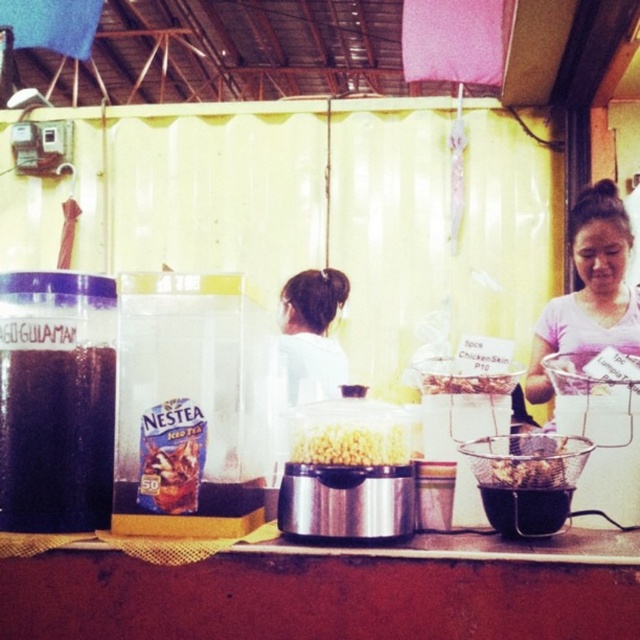
Question: In this image, where is white fabric hair at center located relative to brown crispy chicken skin at center?

Choices:
 (A) left
 (B) right

Answer: (A)

Question: Among these objects, which one is nearest to the camera?

Choices:
 (A) white fabric hair at center
 (B) brown crispy chicken skin at center

Answer: (B)

Question: Does yellow matte popcorn at center have a larger size compared to brown crispy snack at center?

Choices:
 (A) no
 (B) yes

Answer: (B)

Question: Which of the following is the closest to the observer?

Choices:
 (A) brown crispy snack at center
 (B) pink fabric at upper right
 (C) yellow matte popcorn at center
 (D) white fabric hair at center

Answer: (C)

Question: Is brown crispy chicken skin at center positioned at the back of brown crispy snack at center?

Choices:
 (A) yes
 (B) no

Answer: (B)

Question: Which object appears farthest from the camera in this image?

Choices:
 (A) brown crispy chicken skin at center
 (B) brown crispy snack at center

Answer: (B)